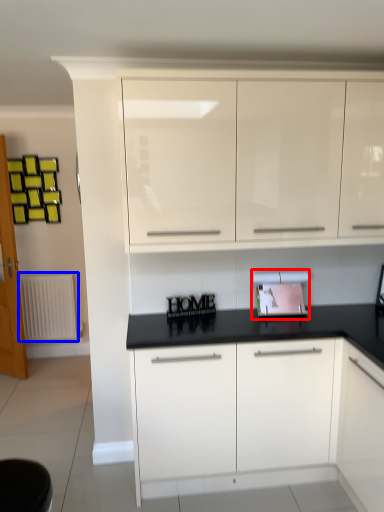
Question: Among these objects, which one is farthest to the camera, appliance (highlighted by a red box) or radiator (highlighted by a blue box)?

Choices:
 (A) appliance
 (B) radiator

Answer: (B)